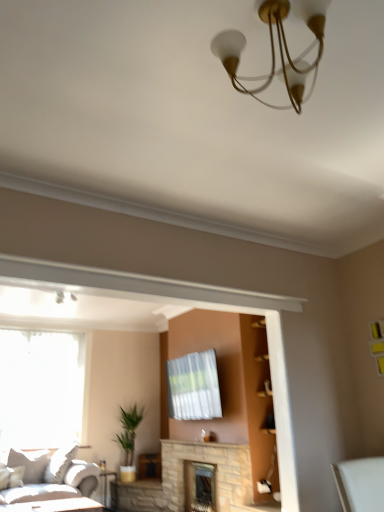
Question: Does green leafy plant at center have a lesser height compared to stone fireplace at center, which ranks as the 1th fireplace in back-to-front order?

Choices:
 (A) no
 (B) yes

Answer: (A)

Question: Would you say stone fireplace at center, the second fireplace when ordered from front to back, is part of green leafy plant at center's contents?

Choices:
 (A) yes
 (B) no

Answer: (B)

Question: From a real-world perspective, is green leafy plant at center positioned under stone fireplace at center, the second fireplace when ordered from front to back, based on gravity?

Choices:
 (A) no
 (B) yes

Answer: (A)

Question: Is green leafy plant at center not within stone fireplace at center, the second fireplace when ordered from front to back?

Choices:
 (A) yes
 (B) no

Answer: (A)

Question: From the image's perspective, is green leafy plant at center under stone fireplace at center, the second fireplace when ordered from front to back?

Choices:
 (A) yes
 (B) no

Answer: (B)

Question: From a real-world perspective, is green leafy plant at center physically above stone fireplace at center, which ranks as the 1th fireplace in back-to-front order?

Choices:
 (A) no
 (B) yes

Answer: (B)

Question: Is stone fireplace at center, which ranks as the second fireplace in back-to-front order, positioned beyond the bounds of green leafy plant at center?

Choices:
 (A) yes
 (B) no

Answer: (A)

Question: Considering the relative sizes of stone fireplace at center, which is the 1th fireplace from front to back, and green leafy plant at center in the image provided, is stone fireplace at center, which is the 1th fireplace from front to back, bigger than green leafy plant at center?

Choices:
 (A) yes
 (B) no

Answer: (B)

Question: Is stone fireplace at center, which is the 1th fireplace from front to back, further to camera compared to green leafy plant at center?

Choices:
 (A) no
 (B) yes

Answer: (A)

Question: Considering the relative sizes of stone fireplace at center, which is the 1th fireplace from front to back, and green leafy plant at center in the image provided, is stone fireplace at center, which is the 1th fireplace from front to back, thinner than green leafy plant at center?

Choices:
 (A) no
 (B) yes

Answer: (B)

Question: Is stone fireplace at center, which ranks as the second fireplace in back-to-front order, shorter than green leafy plant at center?

Choices:
 (A) no
 (B) yes

Answer: (B)

Question: Is stone fireplace at center, which ranks as the second fireplace in back-to-front order, aimed at green leafy plant at center?

Choices:
 (A) yes
 (B) no

Answer: (B)

Question: Considering the relative sizes of stone fireplace at center, which is the 1th fireplace from front to back, and white glossy table at lower left in the image provided, is stone fireplace at center, which is the 1th fireplace from front to back, wider than white glossy table at lower left?

Choices:
 (A) yes
 (B) no

Answer: (B)